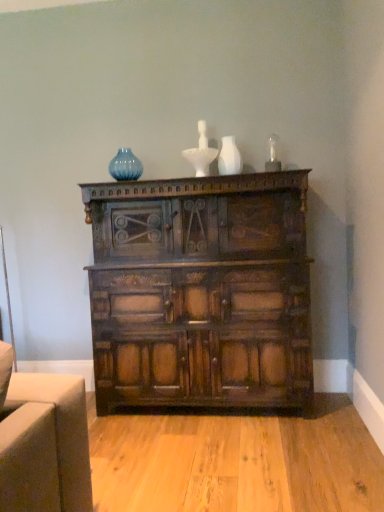
Question: From a real-world perspective, is blue glass vase at upper center physically above white matte vase at upper center?

Choices:
 (A) yes
 (B) no

Answer: (A)

Question: Is blue glass vase at upper center looking in the opposite direction of white matte vase at upper center?

Choices:
 (A) no
 (B) yes

Answer: (A)

Question: Does blue glass vase at upper center come behind white matte vase at upper center?

Choices:
 (A) yes
 (B) no

Answer: (A)

Question: Is blue glass vase at upper center not inside white matte vase at upper center?

Choices:
 (A) no
 (B) yes

Answer: (B)

Question: Considering the relative sizes of blue glass vase at upper center and white matte vase at upper center in the image provided, is blue glass vase at upper center smaller than white matte vase at upper center?

Choices:
 (A) yes
 (B) no

Answer: (B)

Question: Does blue glass vase at upper center have a lesser width compared to white matte vase at upper center?

Choices:
 (A) yes
 (B) no

Answer: (A)

Question: Does white matte vase at upper center have a greater width compared to blue glass vase at upper center?

Choices:
 (A) yes
 (B) no

Answer: (A)

Question: Is white matte vase at upper center positioned far away from blue glass vase at upper center?

Choices:
 (A) yes
 (B) no

Answer: (B)

Question: Does white matte vase at upper center have a lesser width compared to blue glass vase at upper center?

Choices:
 (A) no
 (B) yes

Answer: (A)

Question: Could you tell me if white matte vase at upper center is turned towards blue glass vase at upper center?

Choices:
 (A) yes
 (B) no

Answer: (B)

Question: Is white matte vase at upper center positioned in front of blue glass vase at upper center?

Choices:
 (A) yes
 (B) no

Answer: (A)

Question: Is white matte vase at upper center in contact with blue glass vase at upper center?

Choices:
 (A) no
 (B) yes

Answer: (A)

Question: Does dark brown wood chest of drawers at center have a greater height compared to blue glass vase at upper center?

Choices:
 (A) no
 (B) yes

Answer: (B)